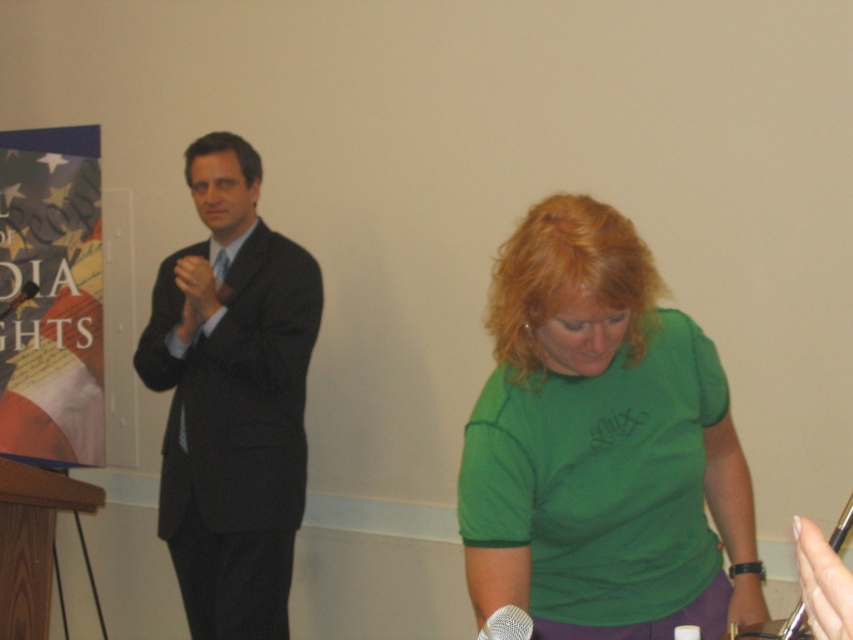
How far apart are camouflage paper poster at left and wooden at left?

camouflage paper poster at left is 3.97 feet from wooden at left.

Is camouflage paper poster at left to the right of wooden at left from the viewer's perspective?

In fact, camouflage paper poster at left is to the left of wooden at left.

Between point (91, 266) and point (4, 531), which one is positioned in front?

Positioned in front is point (4, 531).

At what (x,y) coordinates should I click in order to perform the action: click on camouflage paper poster at left. Please return your answer as a coordinate pair (x, y). The image size is (853, 640). Looking at the image, I should click on (51, 298).

Measure the distance between green matte shirt at lower right and camera.

green matte shirt at lower right and camera are 1.33 meters apart from each other.

The width and height of the screenshot is (853, 640). What do you see at coordinates (601, 444) in the screenshot? I see `green matte shirt at lower right` at bounding box center [601, 444].

Describe the element at coordinates (601, 444) in the screenshot. I see `green matte shirt at lower right` at that location.

Identify the location of green matte shirt at lower right. The image size is (853, 640). (601, 444).

Is dark gray suit at left wider than silver metallic microphone at lower center?

Yes.

Does dark gray suit at left have a greater height compared to silver metallic microphone at lower center?

Indeed, dark gray suit at left has a greater height compared to silver metallic microphone at lower center.

Is point (231, 234) farther from camera compared to point (518, 637)?

Yes, point (231, 234) is farther from viewer.

Locate an element on the screen. The width and height of the screenshot is (853, 640). dark gray suit at left is located at coordinates (231, 397).